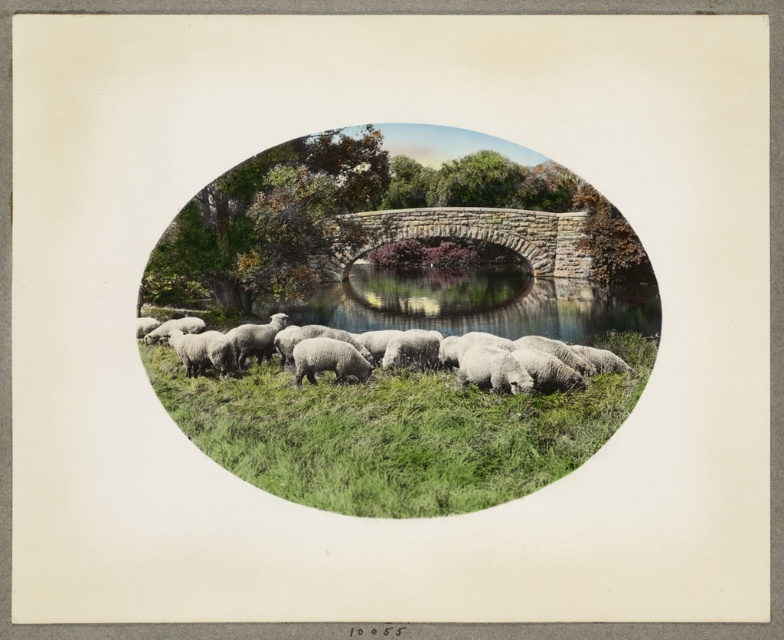
Question: Which of the following is the closest to the observer?

Choices:
 (A) (258, 328)
 (B) (198, 340)
 (C) (363, 147)
 (D) (383, 422)

Answer: (D)

Question: Can you confirm if white woolen sheep at center is positioned to the right of green soft grass at lower center?

Choices:
 (A) yes
 (B) no

Answer: (A)

Question: Is green soft grass at lower center wider than stone textured bridge at center?

Choices:
 (A) yes
 (B) no

Answer: (A)

Question: Which point is closer to the camera?

Choices:
 (A) (510, 218)
 (B) (227, 192)
 (C) (547, 349)
 (D) (207, 337)

Answer: (B)

Question: Based on their relative distances, which object is nearer to the stone textured bridge at center?

Choices:
 (A) green soft grass at lower center
 (B) white woolen sheep at center
 (C) white woolly sheep at center
 (D) white woolly sheep at lower left

Answer: (B)

Question: Is white woolen sheep at center bigger than green soft grass at lower center?

Choices:
 (A) yes
 (B) no

Answer: (A)